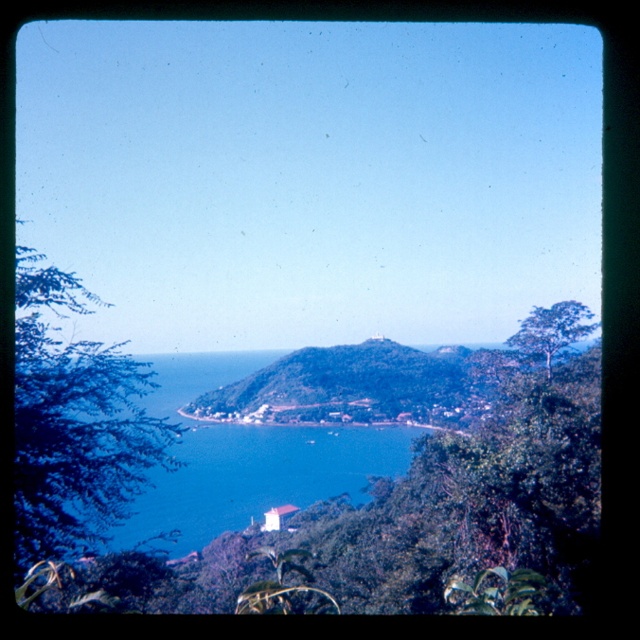
Locate an element on the screen. The width and height of the screenshot is (640, 640). green leafy hillside at center is located at coordinates (342, 387).

Does green leafy hillside at center have a lesser width compared to green leafy tree at upper right?

No.

Which is in front, point (280, 371) or point (556, 333)?

Point (556, 333) is in front.

Locate an element on the screen. The image size is (640, 640). green leafy hillside at center is located at coordinates (342, 387).

Can you confirm if green leafy tree at left is positioned below blue water at center?

Actually, green leafy tree at left is above blue water at center.

Does green leafy tree at left appear on the left side of blue water at center?

Incorrect, green leafy tree at left is not on the left side of blue water at center.

Between point (77, 408) and point (332, 429), which one is positioned in front?

Point (77, 408) is in front.

Where is `green leafy tree at left`? This screenshot has width=640, height=640. green leafy tree at left is located at coordinates (74, 422).

How much distance is there between blue water at center and green leafy hillside at center?

A distance of 15.04 meters exists between blue water at center and green leafy hillside at center.

Can you confirm if blue water at center is taller than green leafy hillside at center?

Correct, blue water at center is much taller as green leafy hillside at center.

Does point (138, 509) lie behind point (392, 410)?

That is False.

I want to click on blue water at center, so coord(244,458).